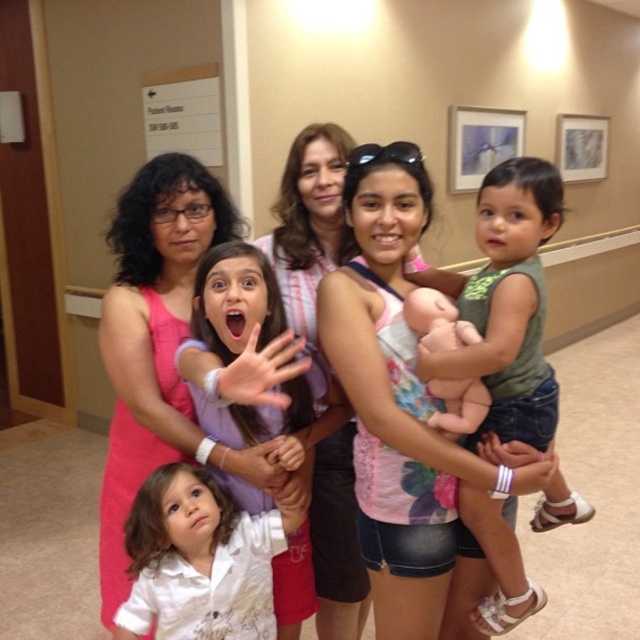
You are a photographer trying to capture a group photo of the family. You notice the green fabric dress at center and the matte purple shirt at center. Which clothing item should you adjust to ensure both are visible in the photo?

The green fabric dress at center is much taller than the matte purple shirt at center, so you should lower the camera angle or adjust the green fabric dress at center to avoid blocking the matte purple shirt at center.

You are standing in the hallway and see the green fabric dress at center and the matte purple shirt at center. Which one is positioned more to the right?

The green fabric dress at center is positioned more to the right than the matte purple shirt at center.